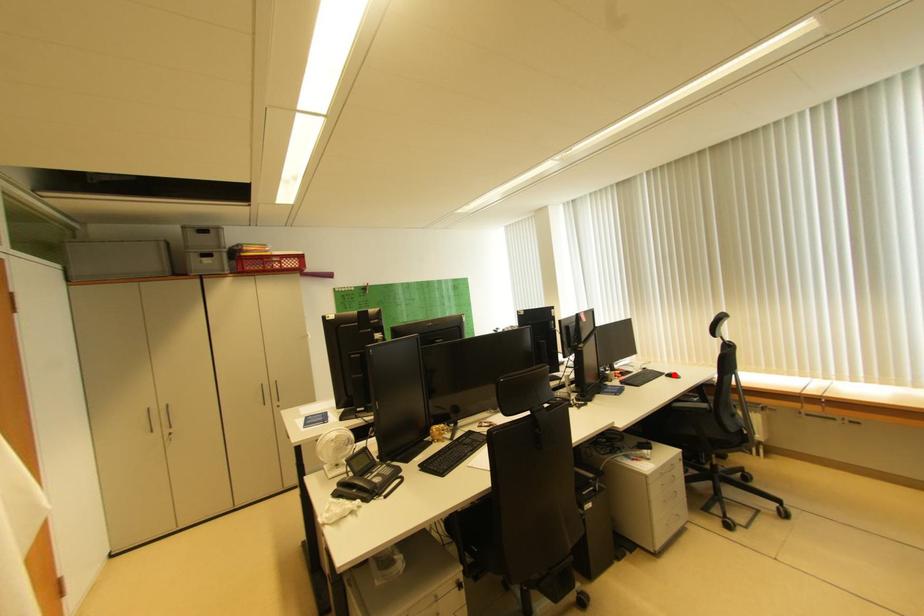
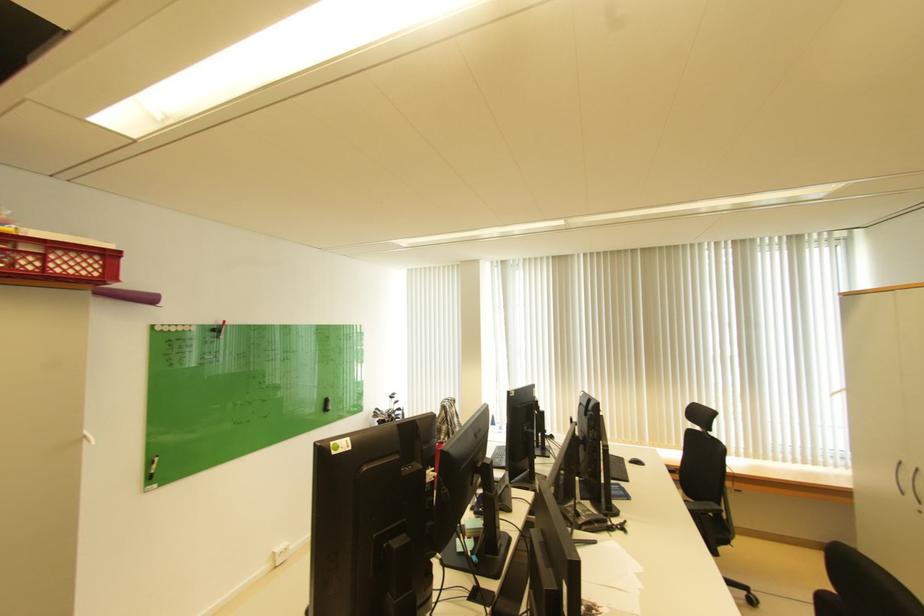
Find the pixel in the second image that matches the highlighted location in the first image.

(638, 461)